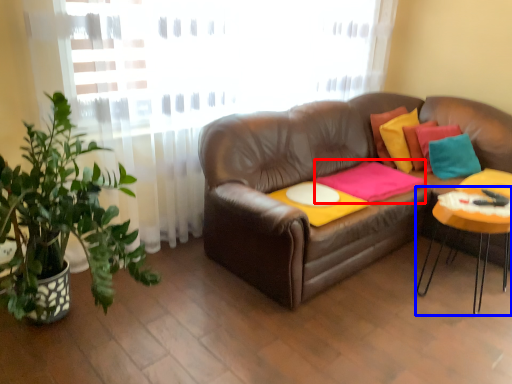
Question: Which point is further to the camera, blanket (highlighted by a red box) or table (highlighted by a blue box)?

Choices:
 (A) blanket
 (B) table

Answer: (A)